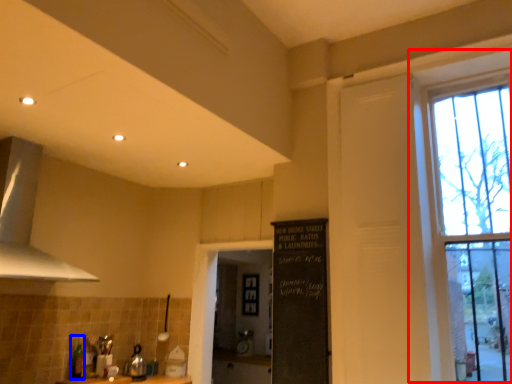
Question: Which object appears farthest to the camera in this image, window (highlighted by a red box) or bottle (highlighted by a blue box)?

Choices:
 (A) window
 (B) bottle

Answer: (B)